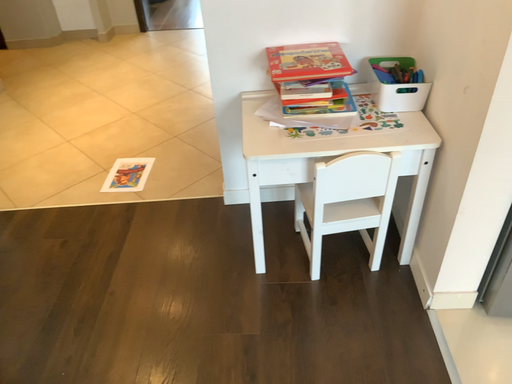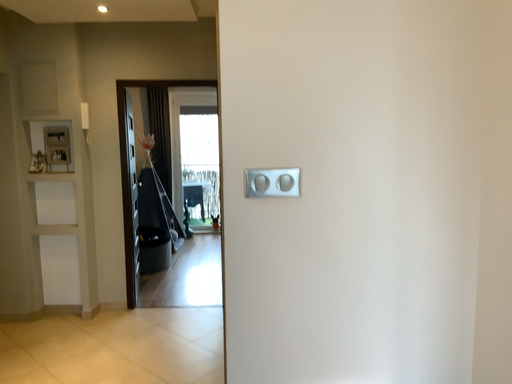
Question: How did the camera likely rotate when shooting the video?

Choices:
 (A) rotated downward
 (B) rotated upward

Answer: (B)